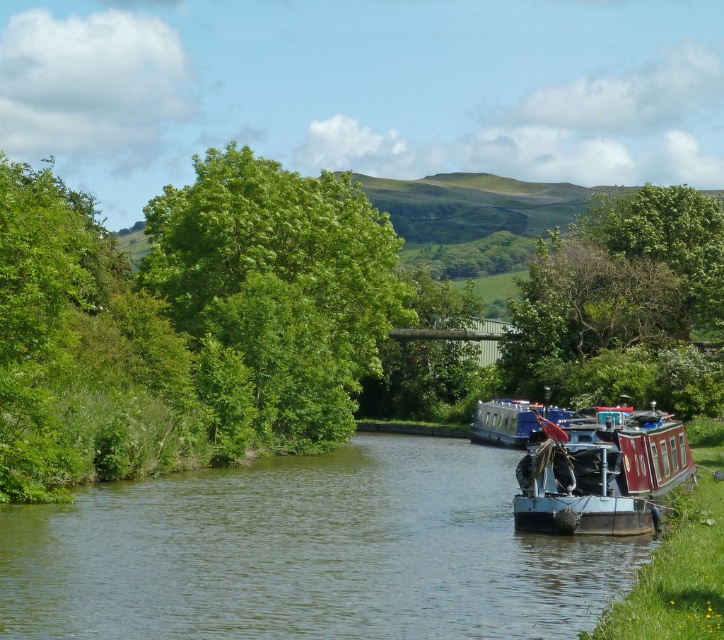
Between green smooth water at center and green leafy tree at upper center, which one appears on the left side from the viewer's perspective?

Positioned to the left is green smooth water at center.

Is green smooth water at center bigger than green leafy tree at upper center?

Actually, green smooth water at center might be smaller than green leafy tree at upper center.

Image resolution: width=724 pixels, height=640 pixels. In order to click on green smooth water at center in this screenshot , I will do `click(307, 552)`.

Can you confirm if green leafy tree at center is positioned above red wooden boat at center?

Correct, green leafy tree at center is located above red wooden boat at center.

Is point (324, 172) farther from camera compared to point (670, 432)?

Yes, point (324, 172) is farther from viewer.

Is point (358, 218) more distant than point (559, 506)?

Yes, it is behind point (559, 506).

The image size is (724, 640). Identify the location of green leafy tree at center. (279, 285).

Which is more to the right, green leafy tree at upper center or blue polished wood boat at center?

From the viewer's perspective, green leafy tree at upper center appears more on the right side.

Can you confirm if green leafy tree at upper center is positioned above blue polished wood boat at center?

Yes, green leafy tree at upper center is above blue polished wood boat at center.

Who is more distant from viewer, (x=660, y=344) or (x=494, y=436)?

The point (x=660, y=344) is behind.

At what (x,y) coordinates should I click in order to perform the action: click on green leafy tree at upper center. Please return your answer as a coordinate pair (x, y). The height and width of the screenshot is (640, 724). Looking at the image, I should click on (622, 301).